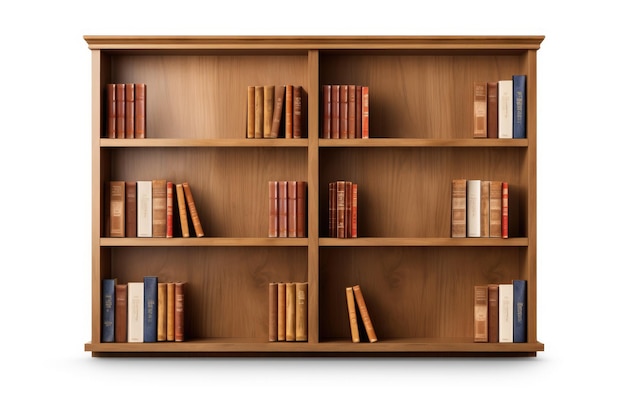
In order to click on books on upper left shelf in this screenshot , I will do `click(111, 106)`, `click(118, 95)`, `click(129, 110)`, `click(139, 104)`, `click(250, 112)`, `click(257, 102)`, `click(267, 110)`, `click(279, 106)`, `click(289, 105)`, `click(295, 114)`.